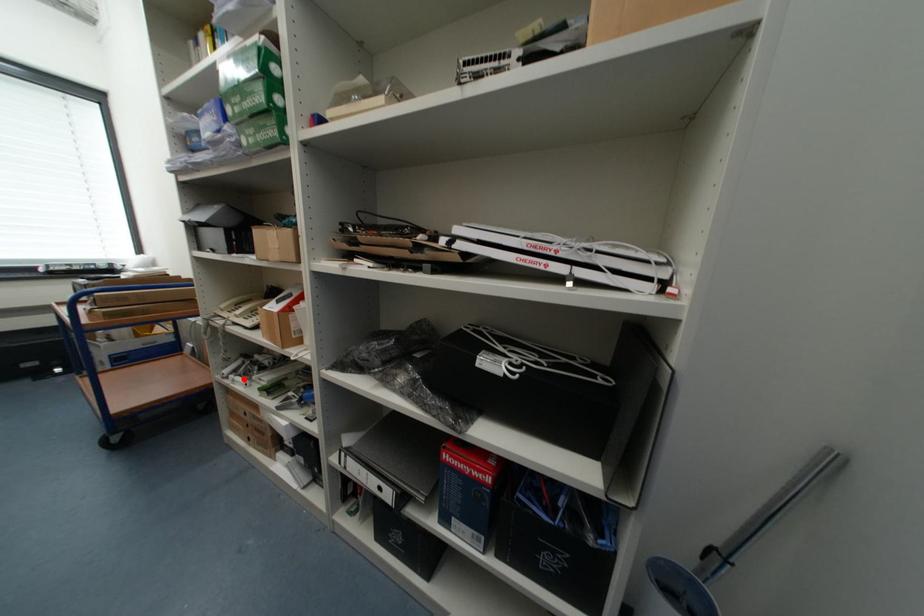
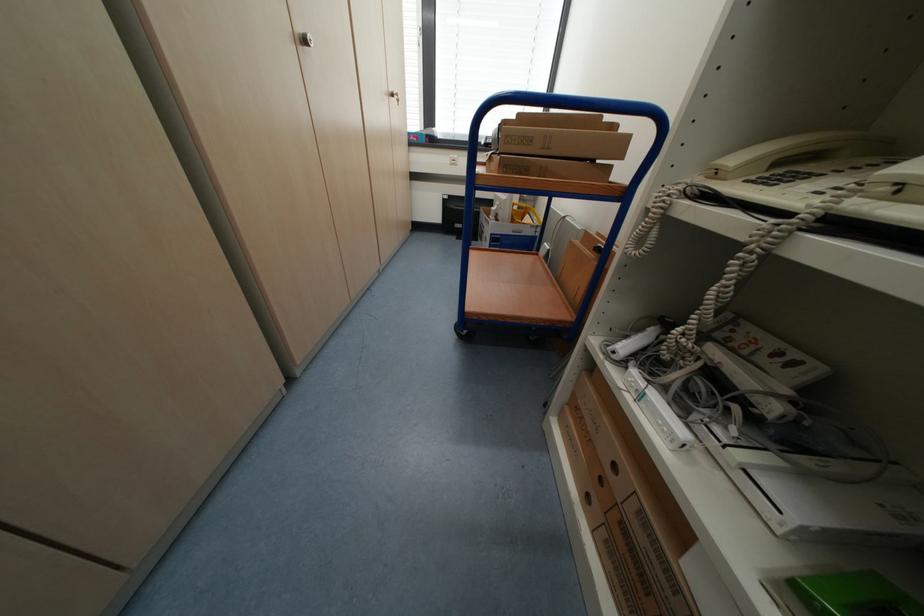
Question: I am providing you with two images of the same scene from different viewpoints. A red point is marked on the first image. Can you still see the location of the red point in image 2?

Choices:
 (A) Yes
 (B) No

Answer: (A)